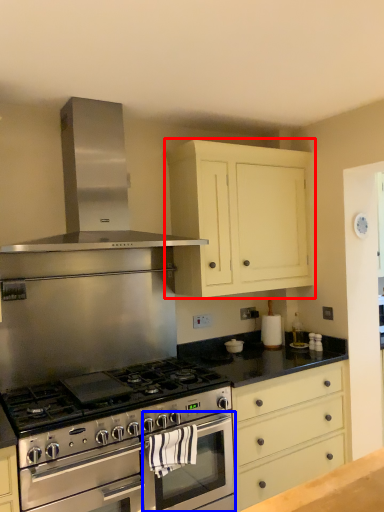
Question: Among these objects, which one is nearest to the camera, cabinetry (highlighted by a red box) or oven (highlighted by a blue box)?

Choices:
 (A) cabinetry
 (B) oven

Answer: (B)